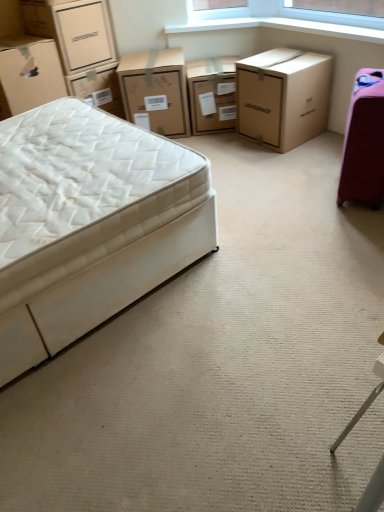
Question: Considering the relative sizes of white fabric bed at left and matte cardboard chest of drawers at center, which is the 2th chest of drawers in right-to-left order, in the image provided, is white fabric bed at left smaller than matte cardboard chest of drawers at center, which is the 2th chest of drawers in right-to-left order,?

Choices:
 (A) no
 (B) yes

Answer: (A)

Question: From the image's perspective, is white fabric bed at left located beneath matte cardboard chest of drawers at center, which is the 2th chest of drawers in left-to-right order?

Choices:
 (A) no
 (B) yes

Answer: (B)

Question: Is white fabric bed at left wider than matte cardboard chest of drawers at center, which is the 2th chest of drawers in left-to-right order?

Choices:
 (A) yes
 (B) no

Answer: (A)

Question: From a real-world perspective, is white fabric bed at left on matte cardboard chest of drawers at center, which is the 2th chest of drawers in right-to-left order?

Choices:
 (A) no
 (B) yes

Answer: (B)

Question: Can you confirm if white fabric bed at left is bigger than matte cardboard chest of drawers at center, which is the 2th chest of drawers in left-to-right order?

Choices:
 (A) yes
 (B) no

Answer: (A)

Question: Is white fabric bed at left to the left or to the right of matte cardboard chest of drawers at center, which is the 2th chest of drawers in right-to-left order, in the image?

Choices:
 (A) left
 (B) right

Answer: (A)

Question: In terms of size, does white fabric bed at left appear bigger or smaller than matte cardboard chest of drawers at center, which is the 2th chest of drawers in right-to-left order?

Choices:
 (A) small
 (B) big

Answer: (B)

Question: From a real-world perspective, is white fabric bed at left positioned above or below matte cardboard chest of drawers at center, which is the 2th chest of drawers in right-to-left order?

Choices:
 (A) above
 (B) below

Answer: (A)

Question: Is point tap(77, 325) positioned closer to the camera than point tap(235, 117)?

Choices:
 (A) closer
 (B) farther

Answer: (A)

Question: Is brown cardboard box at upper right, which is the 3th chest of drawers in left-to-right order, in front of or behind white fabric bed at left in the image?

Choices:
 (A) front
 (B) behind

Answer: (B)

Question: Is brown cardboard box at upper right, the first chest of drawers when ordered from right to left, bigger or smaller than white fabric bed at left?

Choices:
 (A) small
 (B) big

Answer: (A)

Question: From a real-world perspective, relative to white fabric bed at left, is brown cardboard box at upper right, the first chest of drawers when ordered from right to left, vertically above or below?

Choices:
 (A) below
 (B) above

Answer: (A)

Question: From the image's perspective, is brown cardboard box at upper right, the first chest of drawers when ordered from right to left, above or below white fabric bed at left?

Choices:
 (A) above
 (B) below

Answer: (A)

Question: Is white fabric bed at left in front of or behind matte cardboard box at upper left, which appears as the 1th box when ordered from the bottom, in the image?

Choices:
 (A) behind
 (B) front

Answer: (B)

Question: Considering the positions of white fabric bed at left and matte cardboard box at upper left, which appears as the 1th box when ordered from the bottom, in the image, is white fabric bed at left wider or thinner than matte cardboard box at upper left, which appears as the 1th box when ordered from the bottom,?

Choices:
 (A) thin
 (B) wide

Answer: (B)